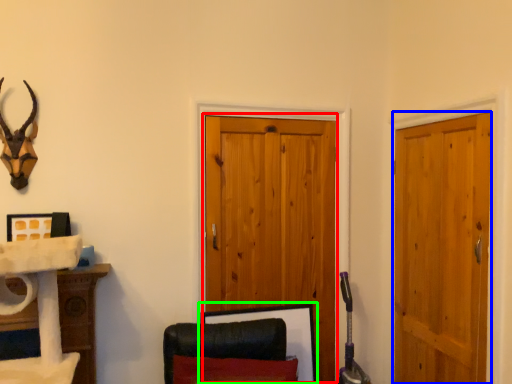
Question: Which object is positioned farthest from barn door (highlighted by a red box)? Select from door (highlighted by a blue box) and picture frame (highlighted by a green box).

Choices:
 (A) door
 (B) picture frame

Answer: (A)